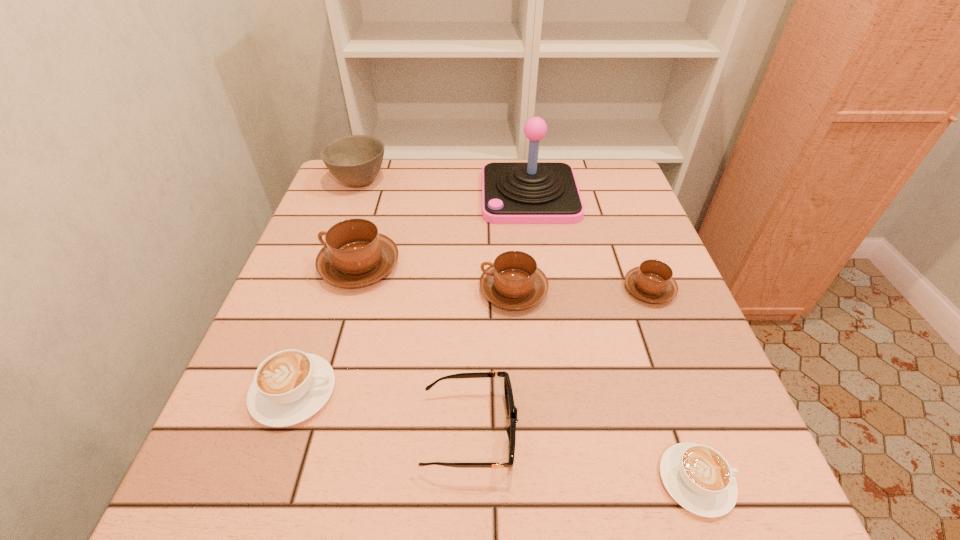
Where is `black sunglasses`? black sunglasses is located at coordinates (511, 409).

Image resolution: width=960 pixels, height=540 pixels. Identify the location of the nearest cappuccino. (699, 478).

Locate an element on the screen. the shortest cappuccino is located at coordinates (699, 478).

Where is `free space located 0.250m forward from the base of the joystick`? free space located 0.250m forward from the base of the joystick is located at coordinates (390, 195).

At what (x,y) coordinates should I click in order to perform the action: click on vacant point located forward from the base of the joystick. Please return your answer as a coordinate pair (x, y). The width and height of the screenshot is (960, 540). Looking at the image, I should click on (416, 195).

Image resolution: width=960 pixels, height=540 pixels. I want to click on vacant area situated forward from the base of the joystick, so click(339, 195).

Locate an element on the screen. vacant space located on the front of the bowl is located at coordinates (333, 251).

Where is `vacant space located on the side of the tallest cappuccino with the handle`? Image resolution: width=960 pixels, height=540 pixels. vacant space located on the side of the tallest cappuccino with the handle is located at coordinates (293, 266).

Locate an element on the screen. Image resolution: width=960 pixels, height=540 pixels. vacant space situated on the side of the third cappuccino from right to left with the handle is located at coordinates [381, 291].

The image size is (960, 540). In order to click on vacant space located 0.260m on the side of the third cappuccino from right to left with the handle in this screenshot , I will do [357, 291].